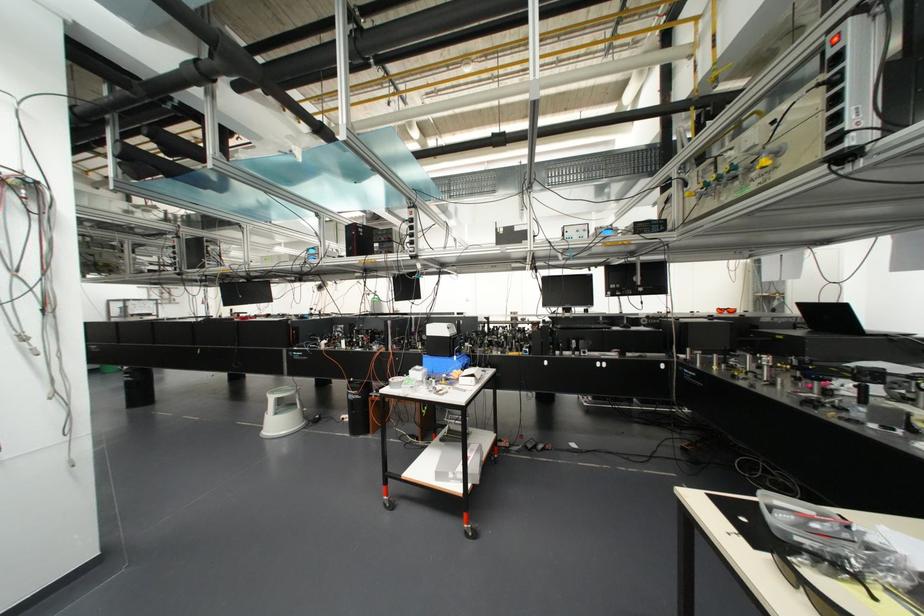
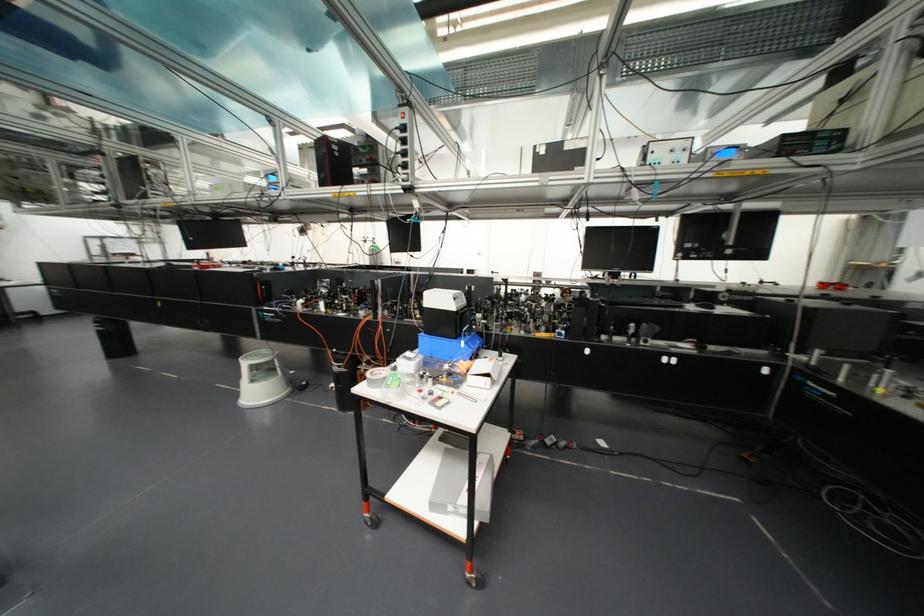
Where in the second image is the point corresponding to the point at 426,359 from the first image?

(422, 338)